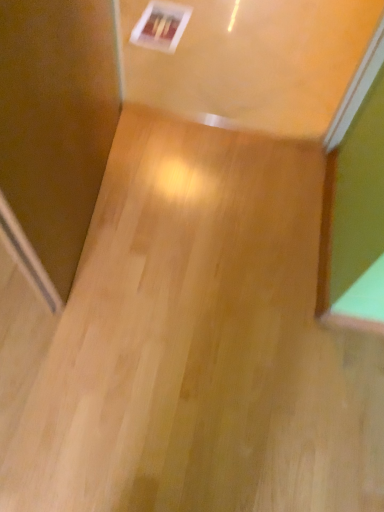
Image resolution: width=384 pixels, height=512 pixels. I want to click on transparent glass door at left, so click(x=55, y=129).

Describe the element at coordinates (55, 129) in the screenshot. I see `transparent glass door at left` at that location.

At what (x,y) coordinates should I click in order to perform the action: click on transparent glass door at left. Please return your answer as a coordinate pair (x, y). Image resolution: width=384 pixels, height=512 pixels. Looking at the image, I should click on (55, 129).